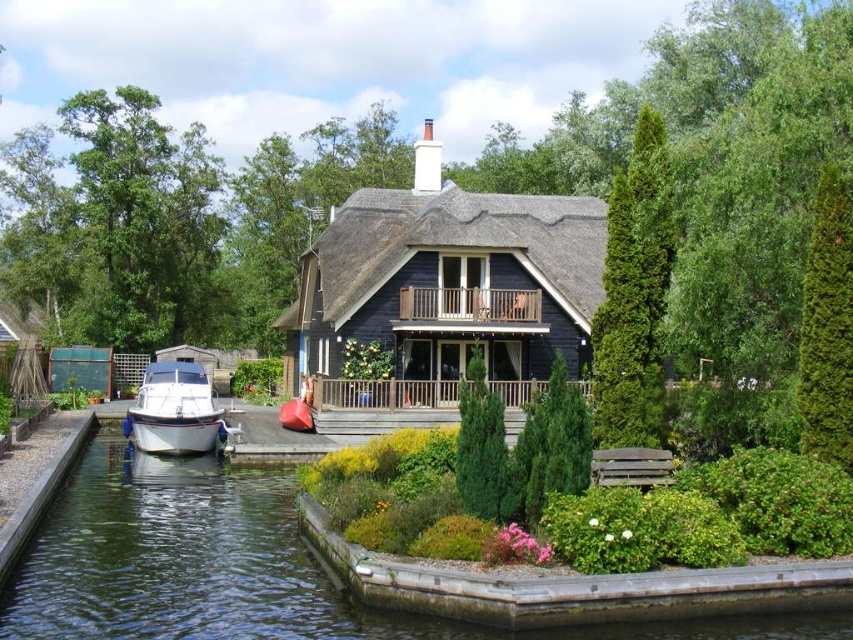
Question: Which object appears farthest from the camera in this image?

Choices:
 (A) dark blue wooden cottage at center
 (B) clear water at lower left
 (C) green textured hedge at right
 (D) white glossy boat at lower left

Answer: (A)

Question: Does green coniferous tree at right appear on the left side of white glossy boat at lower left?

Choices:
 (A) yes
 (B) no

Answer: (B)

Question: Does clear water at lower left have a greater width compared to dark blue wooden cottage at center?

Choices:
 (A) yes
 (B) no

Answer: (A)

Question: Which point is closer to the camera?

Choices:
 (A) white glossy boat at lower left
 (B) clear water at lower left
 (C) dark blue wooden cottage at center
 (D) green textured hedge at right

Answer: (B)

Question: From the image, what is the correct spatial relationship of white glossy boat at lower left in relation to green textured evergreen tree at center?

Choices:
 (A) below
 (B) above

Answer: (A)

Question: Which point is farther from the camera taking this photo?

Choices:
 (A) (430, 404)
 (B) (621, 180)
 (C) (830, 397)

Answer: (A)